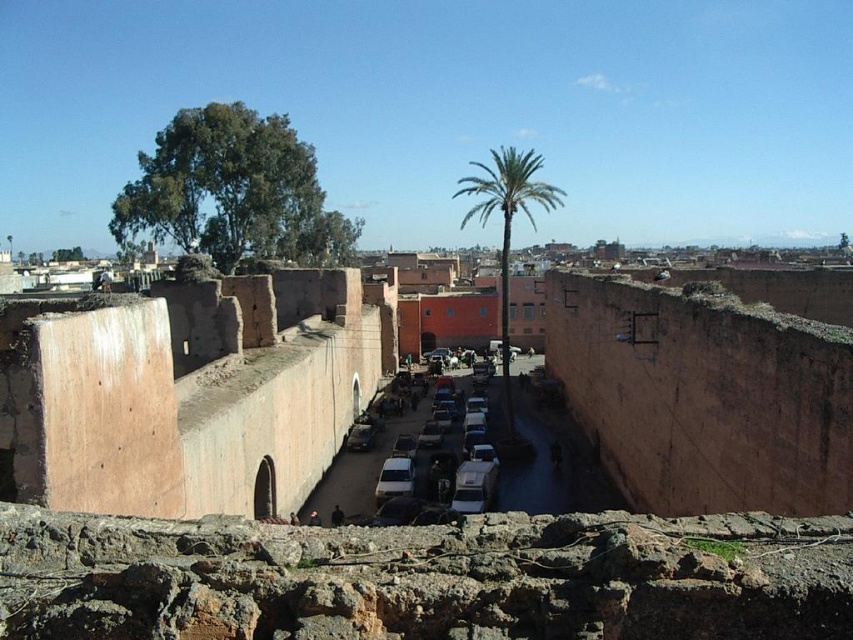
You are a delivery driver who needs to park your matte white van at center in the narrow street. The brown rough stone wall at center is in your way. Can you safely maneuver the van under the wall without hitting it?

The brown rough stone wall at center is above the matte white van at center, so the van can safely maneuver under the wall without hitting it as long as it stays within the street area below.

From the picture: You are a delivery driver who needs to park your matte white van at center in the narrow street. The green leafy palm at center is blocking the path. Can you drive through the space between the palm and the wall?

The green leafy palm at center is above the matte white van at center, so the palm is not blocking the path. The van can drive through the space between the palm and the wall.

You are standing in the historical area looking at the street with parked cars. There are two points marked on the image. The first point is at coordinates point (780, 314) and the second is at point (506, 314). Which point is closer to you?

Point (780, 314) is closer to the viewer than point (506, 314).